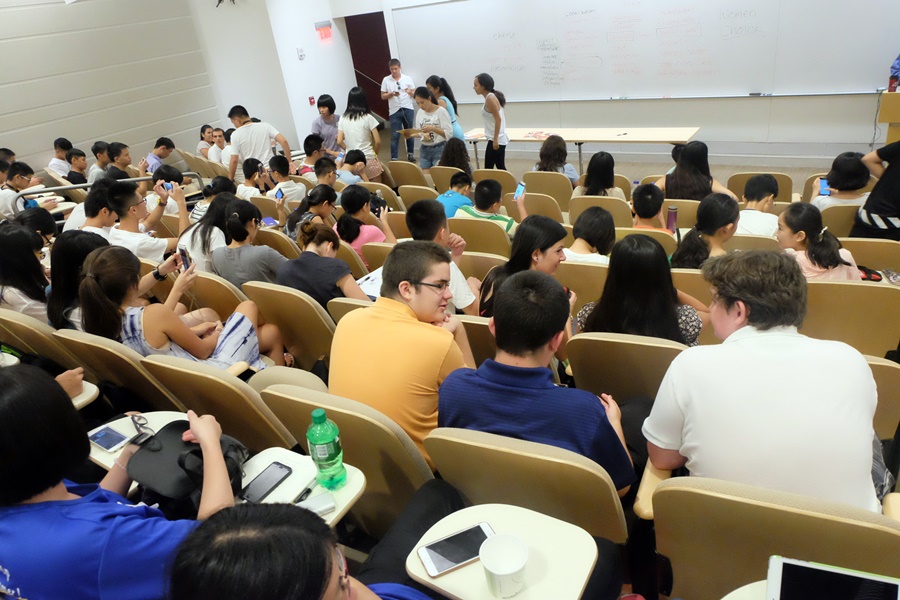
What are the coordinates of `arm rest` in the screenshot? It's located at (646, 484), (892, 504).